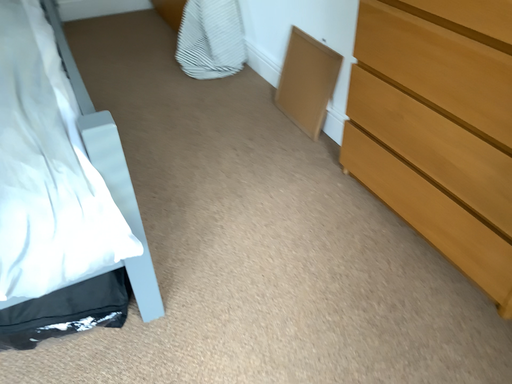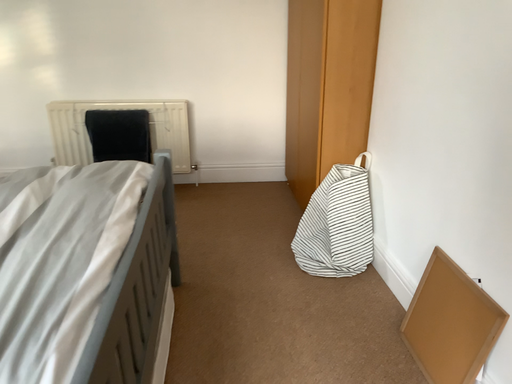
Question: Which way did the camera rotate in the video?

Choices:
 (A) rotated downward
 (B) rotated upward

Answer: (B)